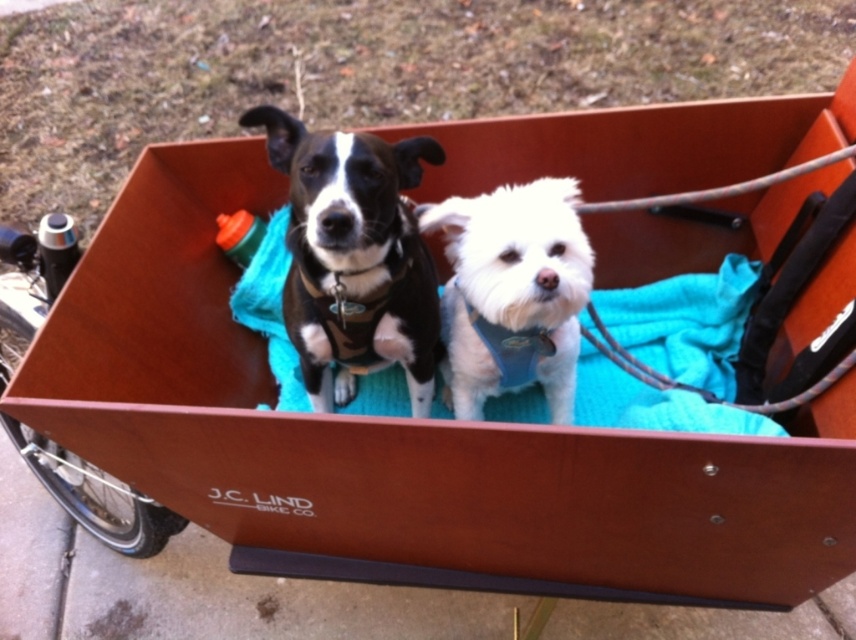
You are a veterinarian examining the dogs in the wooden cargo box. You notice the black matte harness at center and the white fluffy dog at center. Which object is bigger in size?

The black matte harness at center has a larger size compared to the white fluffy dog at center.

You are a delivery person who needs to attach a GPS tracker to the black matte harness at center. The GPS tracker has a range of 1.2 meters. Will you be able to attach it from your current position?

The distance between the black matte harness at center and the viewer is 1.21 meters, which is slightly beyond the GPS tracker range of 1.2 meters. Therefore, you will not be able to attach it from your current position.

You are standing in front of the wooden cargo box attached to the bicycle. There are two points marked inside the box. Point A is at coordinates point [281,131] and Point B is at point [486,362]. Which point is closer to you?

Point A at point [281,131] is closer to the viewer than point B at point [486,362].